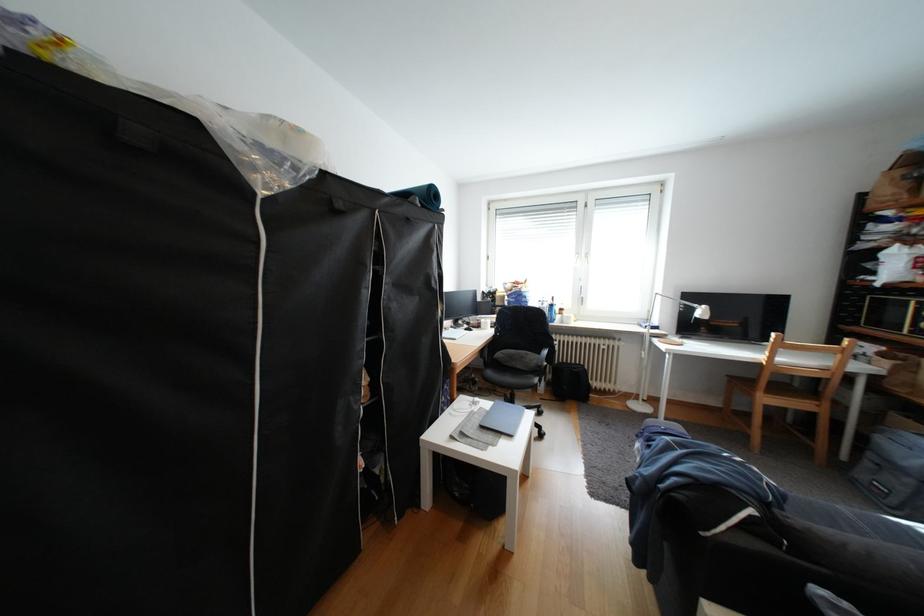
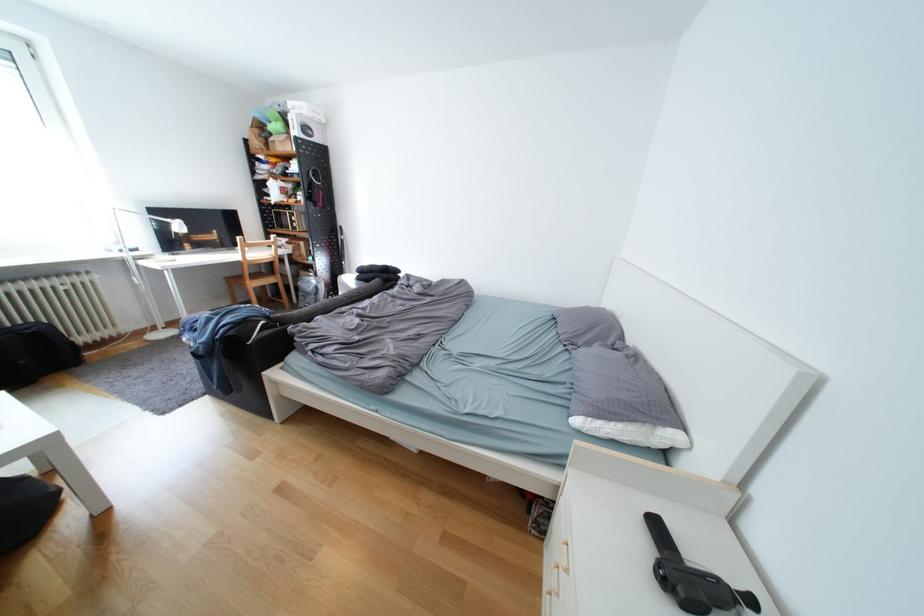
Find the pixel in the second image that matches pixel 779 400 in the first image.

(265, 285)